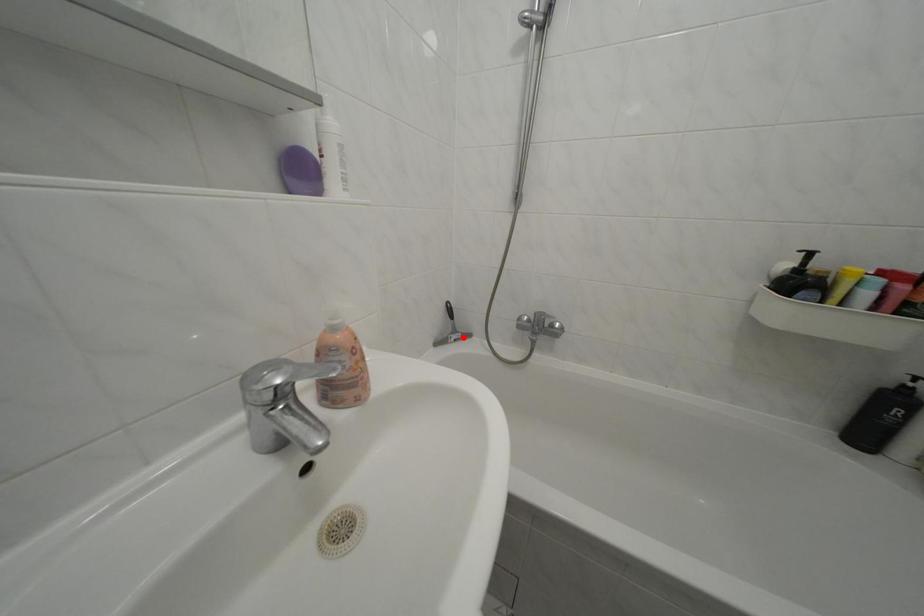
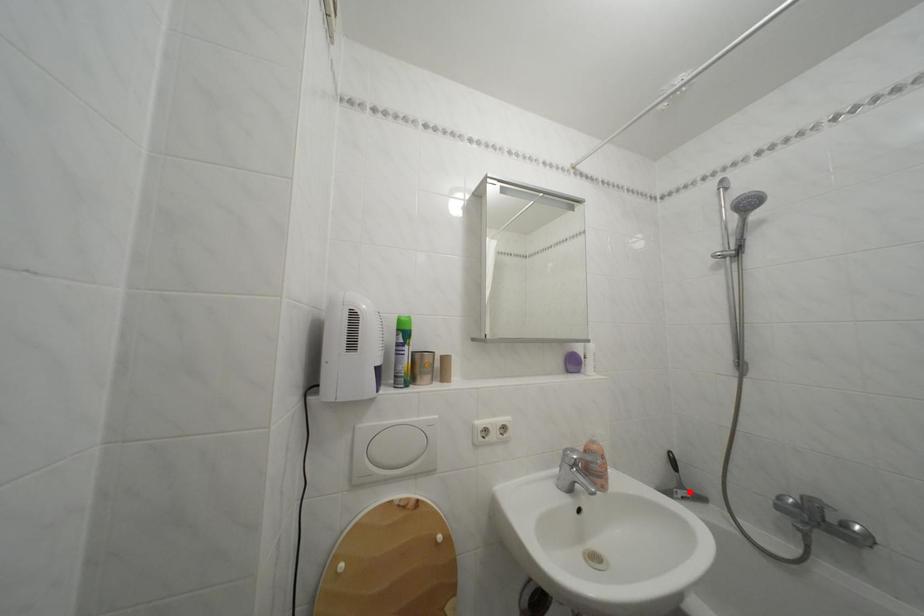
I am providing you with two images of the same scene from different viewpoints. A red point is marked on the first image and another point is marked on the second image. Are the points marked in image1 and image2 representing the same 3D position?

Yes